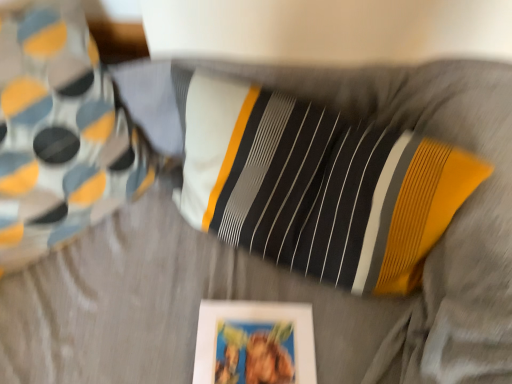
Question: Are matte white picture frame at lower center and striped fabric pillow at upper left making contact?

Choices:
 (A) yes
 (B) no

Answer: (B)

Question: Can you confirm if matte white picture frame at lower center is taller than striped fabric pillow at upper left?

Choices:
 (A) yes
 (B) no

Answer: (B)

Question: Is matte white picture frame at lower center shorter than striped fabric pillow at upper left?

Choices:
 (A) no
 (B) yes

Answer: (B)

Question: Would you say matte white picture frame at lower center contains striped fabric pillow at upper left?

Choices:
 (A) yes
 (B) no

Answer: (B)

Question: Is matte white picture frame at lower center oriented towards striped fabric pillow at upper left?

Choices:
 (A) no
 (B) yes

Answer: (A)

Question: Considering the relative positions of matte white picture frame at lower center and striped fabric pillow at upper left in the image provided, is matte white picture frame at lower center in front of striped fabric pillow at upper left?

Choices:
 (A) no
 (B) yes

Answer: (A)

Question: Considering the relative sizes of striped fabric pillow at upper left and matte white picture frame at lower center in the image provided, is striped fabric pillow at upper left shorter than matte white picture frame at lower center?

Choices:
 (A) no
 (B) yes

Answer: (A)

Question: Is striped fabric pillow at upper left turned away from matte white picture frame at lower center?

Choices:
 (A) yes
 (B) no

Answer: (B)

Question: Can you confirm if striped fabric pillow at upper left is positioned to the left of matte white picture frame at lower center?

Choices:
 (A) no
 (B) yes

Answer: (B)

Question: Is striped fabric pillow at upper left positioned before matte white picture frame at lower center?

Choices:
 (A) yes
 (B) no

Answer: (A)

Question: From a real-world perspective, is striped fabric pillow at upper left located beneath matte white picture frame at lower center?

Choices:
 (A) no
 (B) yes

Answer: (A)

Question: From the image's perspective, would you say striped fabric pillow at upper left is shown under matte white picture frame at lower center?

Choices:
 (A) yes
 (B) no

Answer: (B)

Question: From the image's perspective, is matte white picture frame at lower center positioned above or below striped fabric pillow at upper left?

Choices:
 (A) below
 (B) above

Answer: (A)